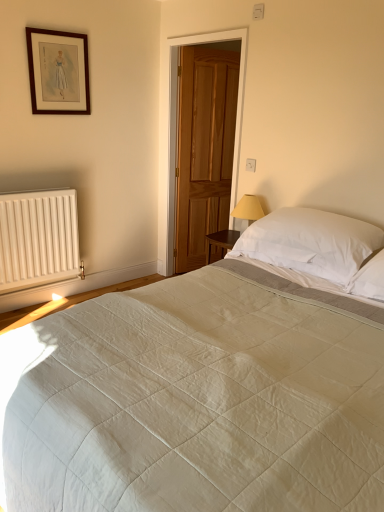
Question: From the image's perspective, is glossy wood door at center located beneath white matte radiator at lower left?

Choices:
 (A) no
 (B) yes

Answer: (A)

Question: Does glossy wood door at center have a larger size compared to white matte radiator at lower left?

Choices:
 (A) no
 (B) yes

Answer: (B)

Question: Does glossy wood door at center appear on the right side of white matte radiator at lower left?

Choices:
 (A) yes
 (B) no

Answer: (A)

Question: Does glossy wood door at center have a lesser width compared to white matte radiator at lower left?

Choices:
 (A) yes
 (B) no

Answer: (A)

Question: Is glossy wood door at center far away from white matte radiator at lower left?

Choices:
 (A) no
 (B) yes

Answer: (B)

Question: Looking at their shapes, would you say glossy wood door at center is wider or thinner than wooden picture frame at upper left?

Choices:
 (A) thin
 (B) wide

Answer: (B)

Question: Relative to wooden picture frame at upper left, is glossy wood door at center in front or behind?

Choices:
 (A) behind
 (B) front

Answer: (A)

Question: Do you think glossy wood door at center is within wooden picture frame at upper left, or outside of it?

Choices:
 (A) outside
 (B) inside

Answer: (A)

Question: From a real-world perspective, relative to wooden picture frame at upper left, is glossy wood door at center vertically above or below?

Choices:
 (A) above
 (B) below

Answer: (B)

Question: Would you say wooden picture frame at upper left is to the left or to the right of white soft pillow at upper right in the picture?

Choices:
 (A) right
 (B) left

Answer: (B)

Question: Is wooden picture frame at upper left wider or thinner than white soft pillow at upper right?

Choices:
 (A) wide
 (B) thin

Answer: (B)

Question: From their relative heights in the image, would you say wooden picture frame at upper left is taller or shorter than white soft pillow at upper right?

Choices:
 (A) short
 (B) tall

Answer: (B)

Question: Looking at the image, does wooden picture frame at upper left seem bigger or smaller compared to white soft pillow at upper right?

Choices:
 (A) big
 (B) small

Answer: (B)

Question: From the image's perspective, is white quilted bed at center positioned above or below white soft pillow at upper right?

Choices:
 (A) above
 (B) below

Answer: (B)

Question: Based on their sizes in the image, would you say white quilted bed at center is bigger or smaller than white soft pillow at upper right?

Choices:
 (A) big
 (B) small

Answer: (A)